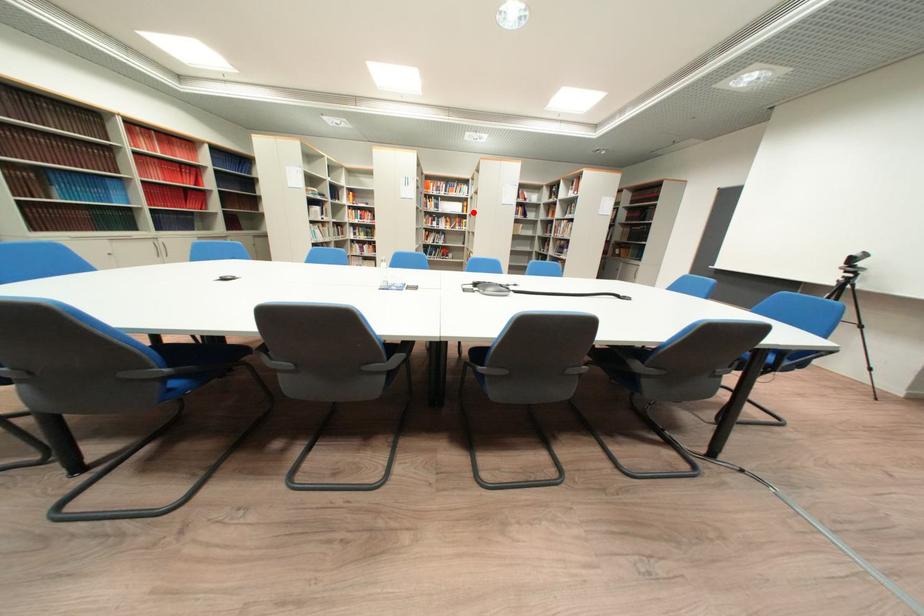
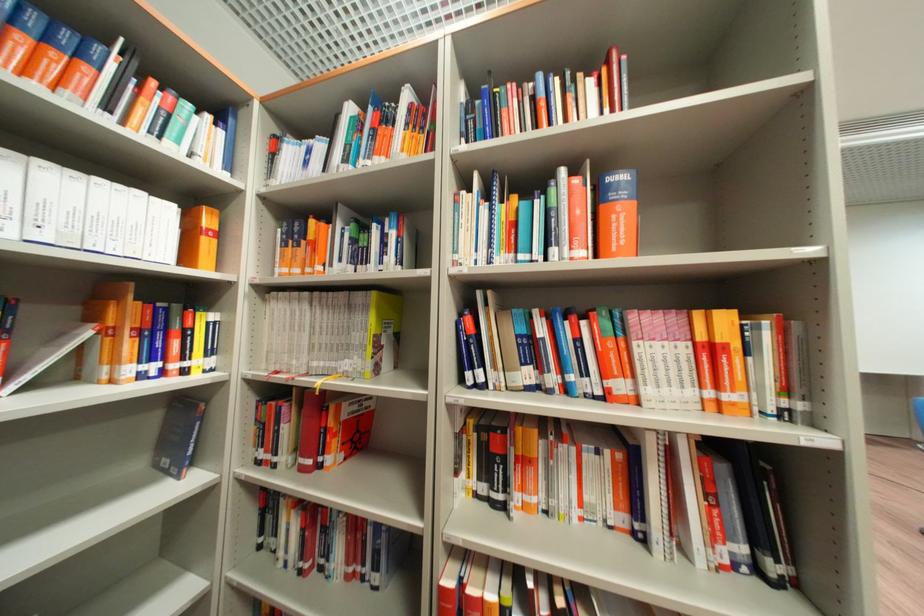
The point at the highlighted location is marked in the first image. Where is the corresponding point in the second image?

(198, 260)